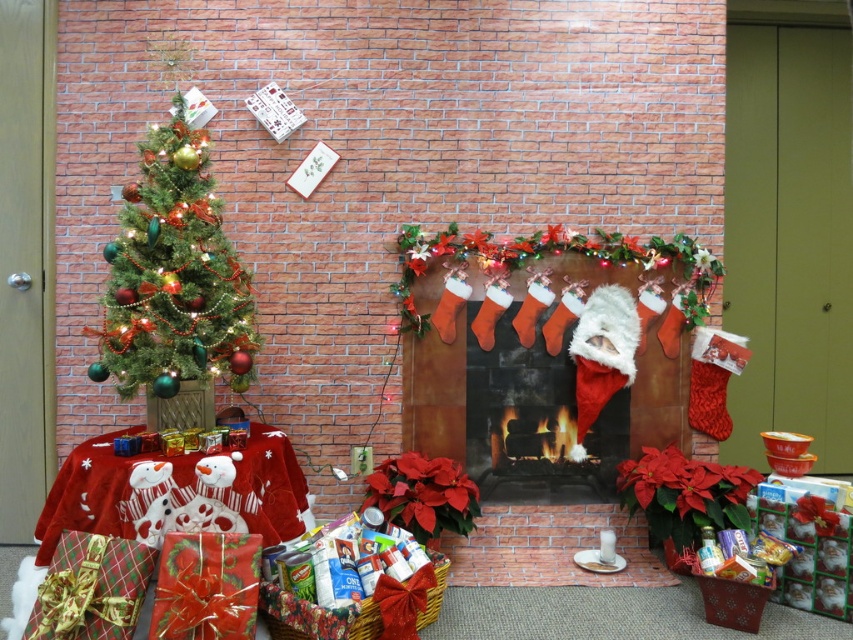
You are planning to place a new decorative item in the center of the fireplace scene. The current setup has a knitted wool fireplace at center and a green matte christmas tree at left. Which object occupies more horizontal space in the scene?

The knitted wool fireplace at center is wider than the green matte christmas tree at left, so it occupies more horizontal space in the scene.

You are standing in front of the festive Christmas setup and want to place a new decoration. You have two points marked on the image where you can place it. The first point is at coordinate point(537, 493) and the second is at point(154, 129). Which point is closer to you?

Point(537, 493) is closer to you because it is further to the viewer than point(154, 129).